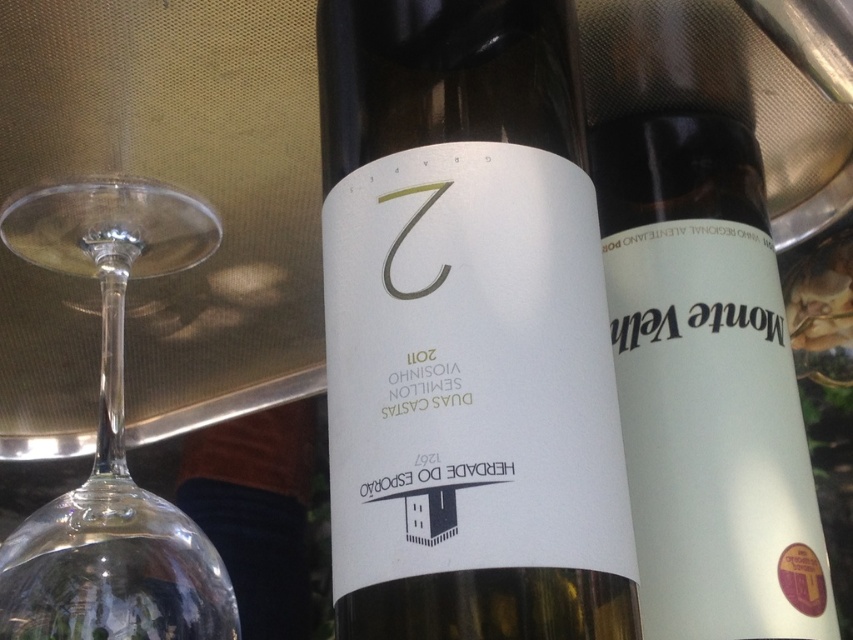
From the picture: You are a wine connoisseur examining two bottles on a reflective surface. You notice a point marked at coordinates (711, 307). Which object does this point belong to?

The point marked at coordinates (711, 307) is on the white matte bottle at center.

Looking at this image, you are a wine collector standing 12 inches away from a white glass bottle at center. You want to pick it up. Is it within your reach?

The white glass bottle at center is 14.08 inches from viewer, so it is 2.08 inches out of reach since you are standing 12 inches away.

You are a bartender preparing a drink and need to place a white glass bottle at center and a transparent glass wine glass at left on a counter. The customer requires that the distance between them must be exactly 8 inches. Based on the image, will the current placement meet the customer requirement?

The distance between the white glass bottle at center and transparent glass wine glass at left is 8.71 inches, which is slightly more than the required 8 inches. Therefore, the current placement does not meet the customer requirement.